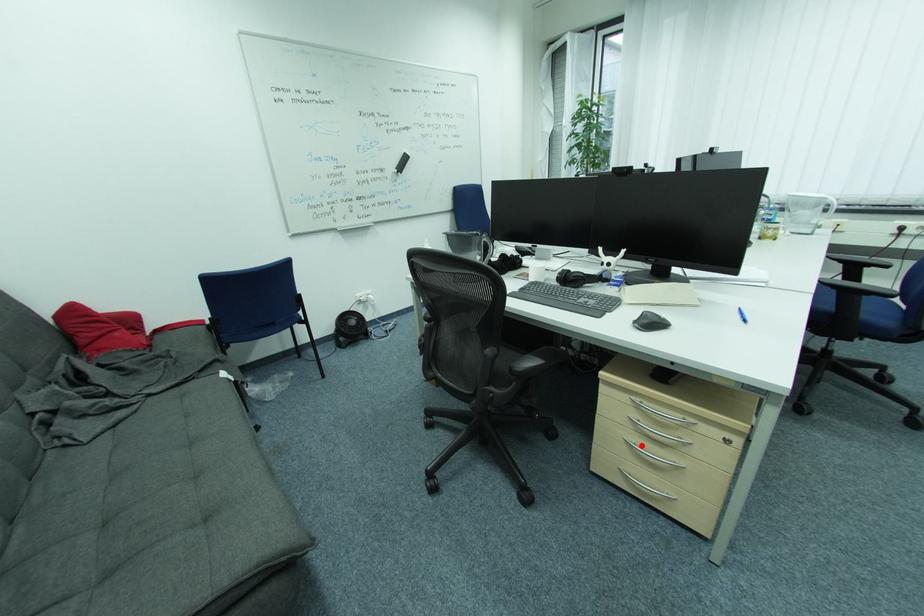
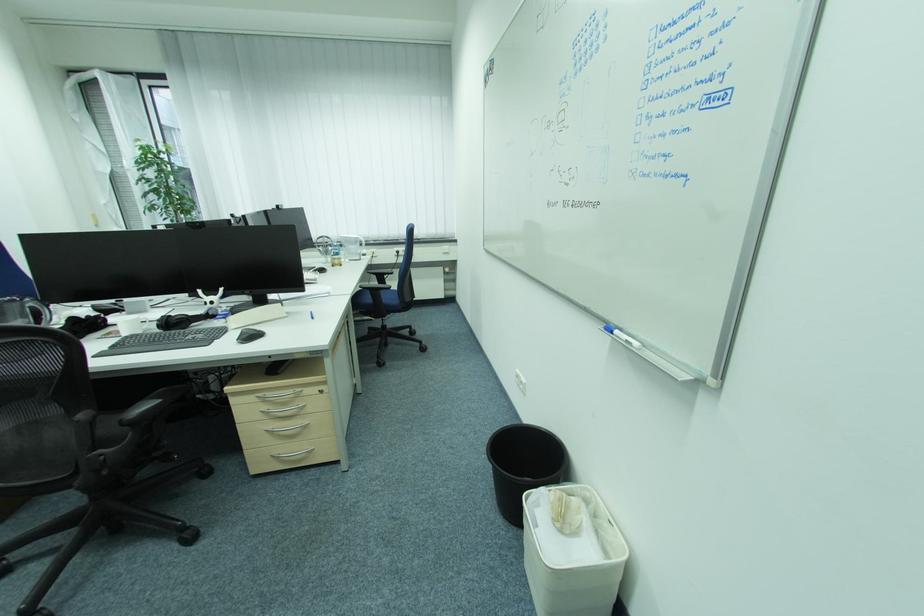
Question: I am providing you with two images of the same scene from different viewpoints. A red point is marked on the first image. Can you still see the location of the red point in image 2?

Choices:
 (A) Yes
 (B) No

Answer: (A)